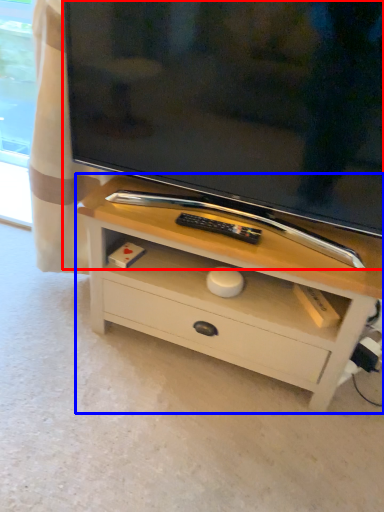
Question: Which object is closer to the camera taking this photo, television (highlighted by a red box) or chest of drawers (highlighted by a blue box)?

Choices:
 (A) television
 (B) chest of drawers

Answer: (A)